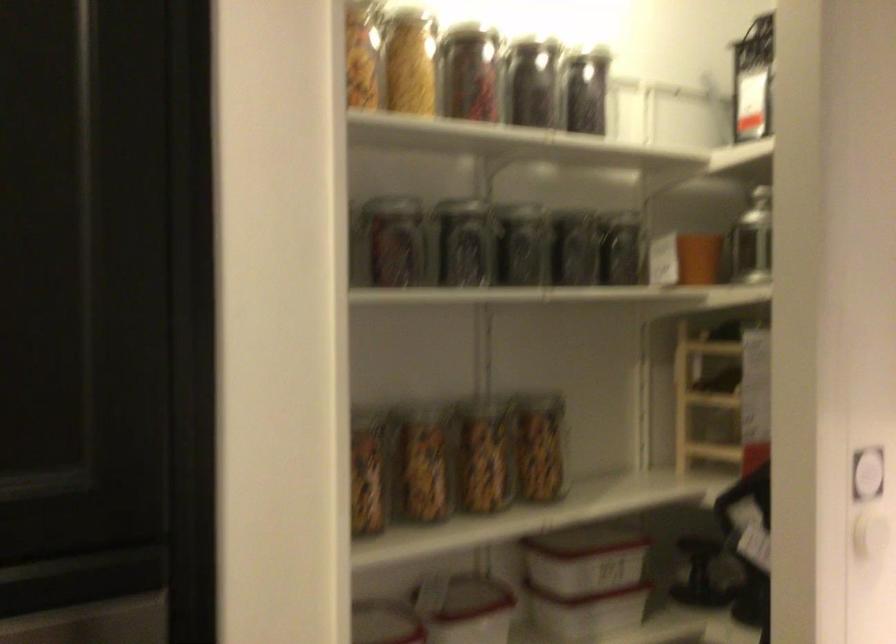
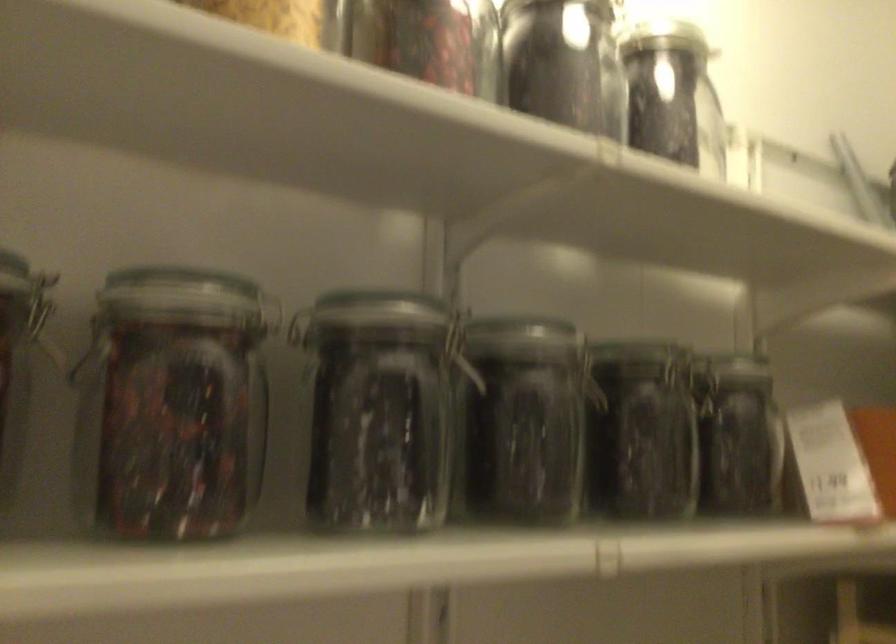
In the second image, find the point that corresponds to point 595,90 in the first image.

(673, 95)